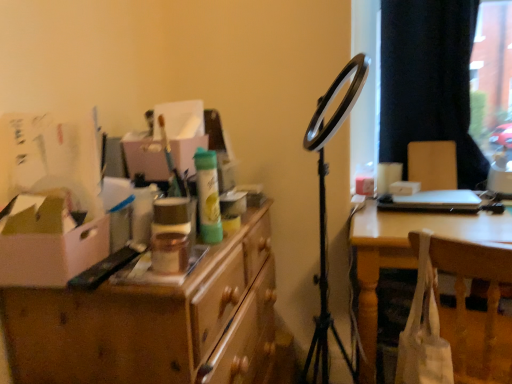
Question: From a real-world perspective, is wooden desk at left physically located above or below green matte spray can at center, the 1th toiletry positioned from the back?

Choices:
 (A) above
 (B) below

Answer: (B)

Question: Is wooden desk at left situated inside green matte spray can at center, the 2th toiletry from the front, or outside?

Choices:
 (A) outside
 (B) inside

Answer: (A)

Question: Which object is positioned farthest from the black fabric curtain at upper right?

Choices:
 (A) wooden desk at left
 (B) white cardboard box at left
 (C) wooden chair at right
 (D) white fabric bag at lower right
 (E) green matte spray can at center, the 2th toiletry from the front

Answer: (B)

Question: Which object is positioned closest to the metallic gold jar at center, acting as the first toiletry starting from the front?

Choices:
 (A) white fabric bag at lower right
 (B) black fabric curtain at upper right
 (C) wooden desk at left
 (D) wooden chair at right
 (E) white cardboard box at left

Answer: (E)